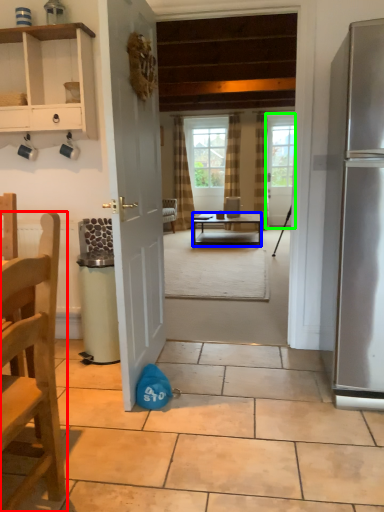
Question: Considering the real-world distances, which object is closest to chair (highlighted by a red box)? desk (highlighted by a blue box) or door (highlighted by a green box).

Choices:
 (A) desk
 (B) door

Answer: (A)